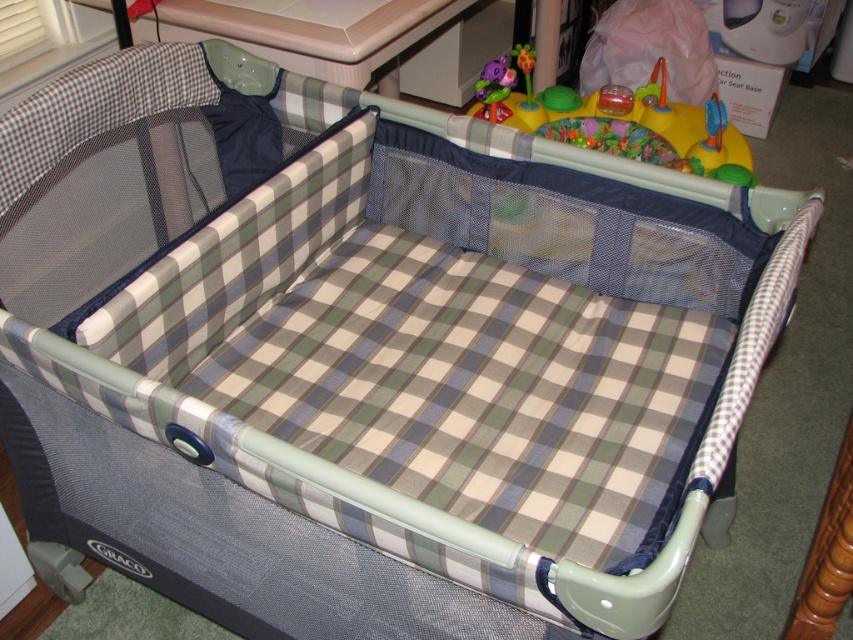
Question: In this image, where is white glossy changing table at upper center located relative to rubberized plastic toy at center?

Choices:
 (A) left
 (B) right

Answer: (A)

Question: Estimate the real-world distances between objects in this image. Which object is closer to the white glossy changing table at upper center?

Choices:
 (A) plush purple elephant at upper center
 (B) rubberized plastic toy at center
 (C) rubberized plastic play gym at upper center

Answer: (A)

Question: Does rubberized plastic play gym at upper center have a larger size compared to plush purple elephant at upper center?

Choices:
 (A) no
 (B) yes

Answer: (B)

Question: Among these points, which one is farthest from the camera?

Choices:
 (A) (459, 72)
 (B) (515, 54)

Answer: (A)

Question: Is plush purple elephant at upper center closer to camera compared to rubberized plastic toy at center?

Choices:
 (A) no
 (B) yes

Answer: (B)

Question: Which object appears closest to the camera in this image?

Choices:
 (A) white glossy changing table at upper center
 (B) rubberized plastic toy at center
 (C) plush purple elephant at upper center
 (D) rubberized plastic play gym at upper center

Answer: (A)